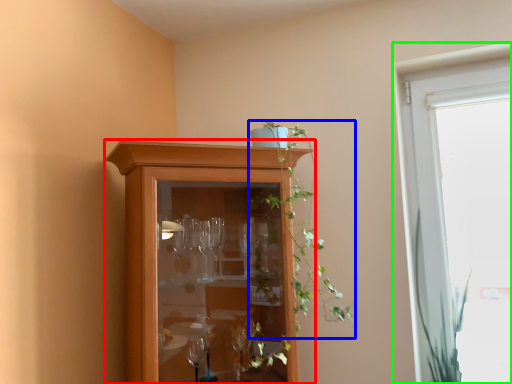
Question: Which object is the farthest from cupboard (highlighted by a red box)? Choose among these: houseplant (highlighted by a blue box) or window (highlighted by a green box).

Choices:
 (A) houseplant
 (B) window

Answer: (B)